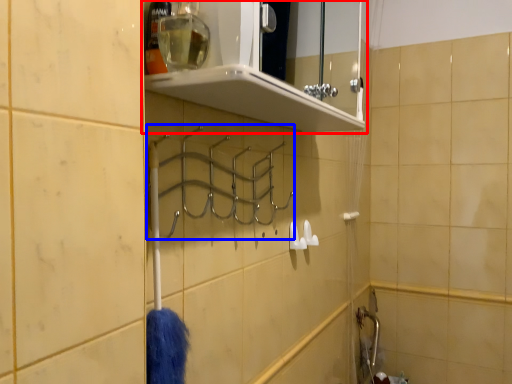
Question: Which object appears farthest to the camera in this image, shelf (highlighted by a red box) or hanger (highlighted by a blue box)?

Choices:
 (A) shelf
 (B) hanger

Answer: (B)